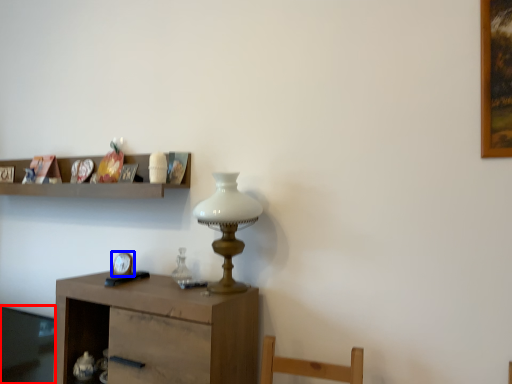
Question: Among these objects, which one is nearest to the camera, glass table (highlighted by a red box) or clock (highlighted by a blue box)?

Choices:
 (A) glass table
 (B) clock

Answer: (B)